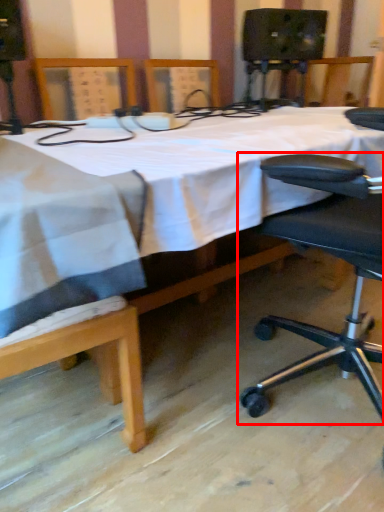
Question: From the image's perspective, what is the correct spatial relationship of chair (annotated by the red box) in relation to table?

Choices:
 (A) above
 (B) below

Answer: (B)